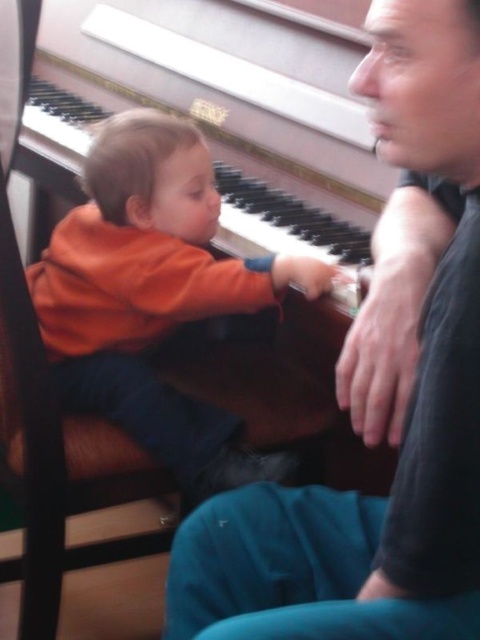
In the scene shown: You are a photographer positioned at the center of the room. You want to take a photo of the matte black shirt at center and the orange soft fabric toddler at center without any blur. The camera has a depth of field that can focus on objects within a 10 inch range. Can both subjects be in focus at the same time?

The matte black shirt at center is 14.26 inches away from orange soft fabric toddler at center. Since the distance between them exceeds the 10 inch range of the camera, both subjects cannot be in focus simultaneously.

You are a photographer setting up for a family portrait. You need to position a matte black shirt at center and an orange soft fabric toddler at center so that both fit within a 1.2 meter wide frame. Given their widths, will they fit side by side?

The matte black shirt at center has a lesser width compared to orange soft fabric toddler at center. However, without knowing the exact widths of both objects, it is impossible to determine if their combined width will exceed 1.2 meters. Additional measurements are needed.

You are a photographer standing in front of the Steinway piano. You want to take a photo of the matte black shirt at center and the orange soft fabric toddler at center. Based on their positions, which object should you focus on first to ensure both are in focus?

The matte black shirt at center is below orange soft fabric toddler at center, so you should focus on the orange soft fabric toddler at center first to ensure both are in focus.